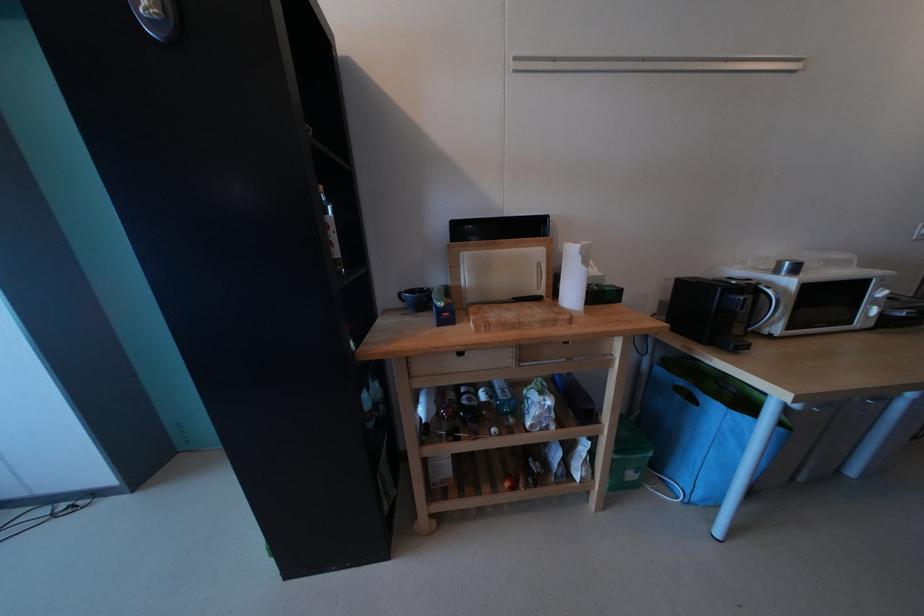
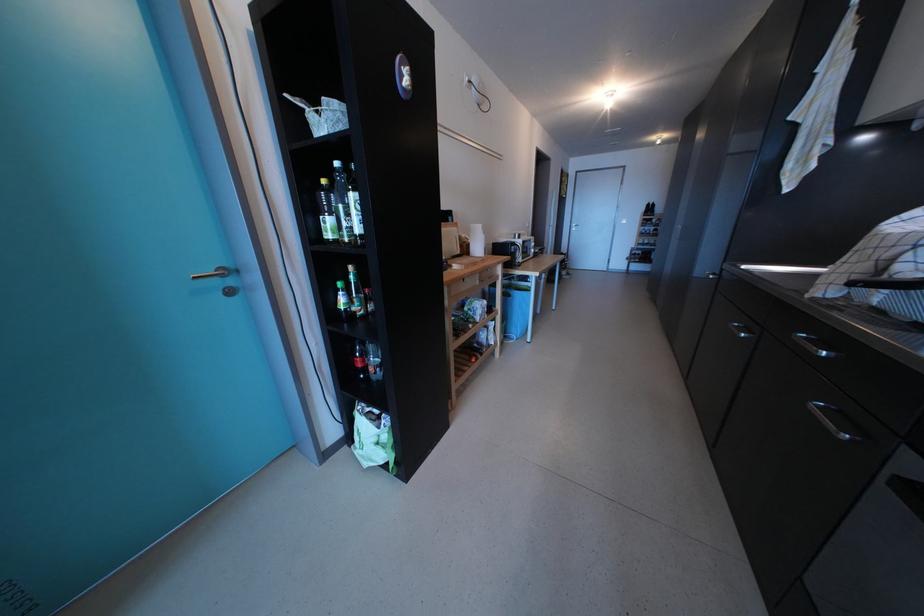
Where in the second image is the point corresponding to the point at 565,246 from the first image?

(469, 230)